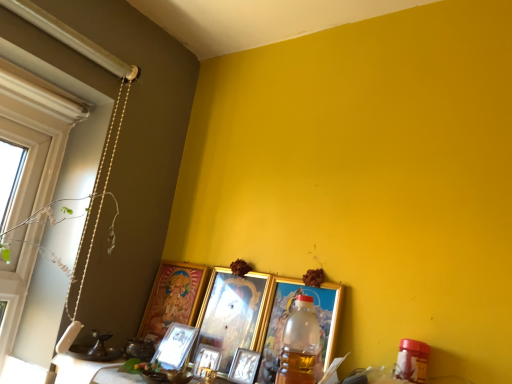
Where is `pearl necklace at left`? pearl necklace at left is located at coordinates (102, 191).

This screenshot has height=384, width=512. What do you see at coordinates (244, 366) in the screenshot?
I see `metallic gold picture frame at center, the fifth picture frame when ordered from left to right` at bounding box center [244, 366].

You are a GUI agent. You are given a task and a screenshot of the screen. Output one action in this format:
    pyautogui.click(x=<x>, y=<y>)
    Task: Click on the metallic gold table at lower center
    
    Given the screenshot: What is the action you would take?
    pyautogui.click(x=91, y=372)

The height and width of the screenshot is (384, 512). What do you see at coordinates (91, 372) in the screenshot? I see `metallic gold table at lower center` at bounding box center [91, 372].

Where is `pearl necklace at left`? This screenshot has height=384, width=512. pearl necklace at left is located at coordinates (102, 191).

Visually, is metallic silver picture frame at lower center, the 2th picture frame from the left, positioned to the left or to the right of gold metallic picture frame at center, which is the 6th picture frame from left to right?

In the image, metallic silver picture frame at lower center, the 2th picture frame from the left, appears on the left side of gold metallic picture frame at center, which is the 6th picture frame from left to right.

From the image's perspective, is metallic silver picture frame at lower center, which appears as the 5th picture frame when viewed from the right, below gold metallic picture frame at center, which is the 6th picture frame from left to right?

Indeed, from the image's perspective, metallic silver picture frame at lower center, which appears as the 5th picture frame when viewed from the right, is shown beneath gold metallic picture frame at center, which is the 6th picture frame from left to right.

Looking at this image, can you tell me how much metallic silver picture frame at lower center, which appears as the 5th picture frame when viewed from the right, and gold metallic picture frame at center, arranged as the first picture frame when viewed from the right, differ in facing direction?

There is a 5.89-degree angle between the facing directions of metallic silver picture frame at lower center, which appears as the 5th picture frame when viewed from the right, and gold metallic picture frame at center, arranged as the first picture frame when viewed from the right.

From a real-world perspective, between metallic silver picture frame at lower center, the 2th picture frame from the left, and gold metallic picture frame at center, arranged as the first picture frame when viewed from the right, who is vertically lower?

From a 3D spatial view, metallic silver picture frame at lower center, the 2th picture frame from the left, is below.

Is gold metallic picture frame at center, the third picture frame positioned from the right, directly adjacent to pearl necklace at left?

gold metallic picture frame at center, the third picture frame positioned from the right, and pearl necklace at left are not in contact.

Is gold metallic picture frame at center, the third picture frame positioned from the right, in front of or behind pearl necklace at left in the image?

In the image, gold metallic picture frame at center, the third picture frame positioned from the right, appears behind pearl necklace at left.

Who is smaller, gold metallic picture frame at center, which is counted as the 4th picture frame, starting from the left, or pearl necklace at left?

Smaller between the two is pearl necklace at left.

Measure the distance from gold metallic picture frame at center, the third picture frame positioned from the right, to pearl necklace at left.

gold metallic picture frame at center, the third picture frame positioned from the right, and pearl necklace at left are 14.66 inches apart.

Are gold-framed picture at lower left, the first picture frame from the left, and metallic silver picture frame at lower center, which appears as the 5th picture frame when viewed from the right, far apart?

No, there isn't a large distance between gold-framed picture at lower left, the first picture frame from the left, and metallic silver picture frame at lower center, which appears as the 5th picture frame when viewed from the right.

Can you confirm if gold-framed picture at lower left, the 6th picture frame positioned from the right, is wider than metallic silver picture frame at lower center, which appears as the 5th picture frame when viewed from the right?

Correct, the width of gold-framed picture at lower left, the 6th picture frame positioned from the right, exceeds that of metallic silver picture frame at lower center, which appears as the 5th picture frame when viewed from the right.

Is the position of gold-framed picture at lower left, the first picture frame from the left, less distant than that of metallic silver picture frame at lower center, the 2th picture frame from the left?

That is True.

From a real-world perspective, which is physically above, gold-framed picture at lower left, the first picture frame from the left, or metallic silver picture frame at lower center, which appears as the 5th picture frame when viewed from the right?

In real-world perspective, gold-framed picture at lower left, the first picture frame from the left, is above.

Based on their positions, is pearl necklace at left located to the left or right of metallic silver picture frame at center, positioned as the 4th picture frame in right-to-left order?

From the image, it's evident that pearl necklace at left is to the left of metallic silver picture frame at center, positioned as the 4th picture frame in right-to-left order.

From the image's perspective, does pearl necklace at left appear lower than metallic silver picture frame at center, positioned as the 4th picture frame in right-to-left order?

Incorrect, from the image's perspective, pearl necklace at left is higher than metallic silver picture frame at center, positioned as the 4th picture frame in right-to-left order.

Based on the photo, from a real-world perspective, is pearl necklace at left below metallic silver picture frame at center, positioned as the 4th picture frame in right-to-left order?

No, from a real-world perspective, pearl necklace at left is not beneath metallic silver picture frame at center, positioned as the 4th picture frame in right-to-left order.

Considering the sizes of pearl necklace at left and metallic silver picture frame at center, positioned as the 4th picture frame in right-to-left order, in the image, is pearl necklace at left wider or thinner than metallic silver picture frame at center, positioned as the 4th picture frame in right-to-left order,?

Considering their sizes, pearl necklace at left looks broader than metallic silver picture frame at center, positioned as the 4th picture frame in right-to-left order.

Based on their positions, is white matte window at left located to the left or right of translucent plastic bottle at center?

white matte window at left is positioned on translucent plastic bottle at center's left side.

This screenshot has height=384, width=512. I want to click on bottle below the white matte window at left (from the image's perspective), so click(300, 344).

From the image's perspective, which object appears higher, white matte window at left or translucent plastic bottle at center?

white matte window at left, from the image's perspective.

How many degrees apart are the facing directions of pearl necklace at left and gold metallic picture frame at center, arranged as the first picture frame when viewed from the right?

The facing directions of pearl necklace at left and gold metallic picture frame at center, arranged as the first picture frame when viewed from the right, are 88.2 degrees apart.

From the image's perspective, relative to gold metallic picture frame at center, which is the 6th picture frame from left to right, is pearl necklace at left above or below?

Clearly, from the image's perspective, pearl necklace at left is above gold metallic picture frame at center, which is the 6th picture frame from left to right.

Relative to gold metallic picture frame at center, which is the 6th picture frame from left to right, is pearl necklace at left in front or behind?

pearl necklace at left is positioned farther from the viewer than gold metallic picture frame at center, which is the 6th picture frame from left to right.

Considering the sizes of objects pearl necklace at left and gold metallic picture frame at center, arranged as the first picture frame when viewed from the right, in the image provided, who is thinner, pearl necklace at left or gold metallic picture frame at center, arranged as the first picture frame when viewed from the right,?

gold metallic picture frame at center, arranged as the first picture frame when viewed from the right.

Considering the positions of objects pearl necklace at left and metallic gold picture frame at center, the second picture frame from the right, in the image provided, who is more to the right, pearl necklace at left or metallic gold picture frame at center, the second picture frame from the right,?

metallic gold picture frame at center, the second picture frame from the right.

Is pearl necklace at left oriented towards metallic gold picture frame at center, the second picture frame from the right?

No, pearl necklace at left is not aimed at metallic gold picture frame at center, the second picture frame from the right.

Looking at this image, how different are the orientations of pearl necklace at left and metallic gold picture frame at center, the second picture frame from the right, in degrees?

The facing directions of pearl necklace at left and metallic gold picture frame at center, the second picture frame from the right, are 94.1 degrees apart.

Where is `picture frame that is the 5th object located in front of the metallic silver picture frame at lower center, the 2th picture frame from the left`? Image resolution: width=512 pixels, height=384 pixels. picture frame that is the 5th object located in front of the metallic silver picture frame at lower center, the 2th picture frame from the left is located at coordinates (287, 319).

Starting from the pearl necklace at left, which picture frame is the 1st one behind? Please provide its 2D coordinates.

[(231, 313)]

When comparing their distances from metallic gold table at lower center, does translucent plastic bottle at center or metallic silver picture frame at lower center, the 2th picture frame from the left, seem further?

Based on the image, translucent plastic bottle at center appears to be further to metallic gold table at lower center.

Estimate the real-world distances between objects in this image. Which object is closer to metallic silver picture frame at center, positioned as the 4th picture frame in right-to-left order, gold metallic picture frame at center, which is the 6th picture frame from left to right, or translucent plastic bottle at center?

Based on the image, gold metallic picture frame at center, which is the 6th picture frame from left to right, appears to be nearer to metallic silver picture frame at center, positioned as the 4th picture frame in right-to-left order.

When comparing their distances from metallic gold picture frame at center, the second picture frame from the right, does gold metallic picture frame at center, which is the 6th picture frame from left to right, or metallic silver picture frame at lower center, which appears as the 5th picture frame when viewed from the right, seem further?

metallic silver picture frame at lower center, which appears as the 5th picture frame when viewed from the right, is positioned further to the anchor metallic gold picture frame at center, the second picture frame from the right.

Estimate the real-world distances between objects in this image. Which object is closer to metallic silver picture frame at lower center, the 2th picture frame from the left, metallic gold picture frame at center, the fifth picture frame when ordered from left to right, or gold metallic picture frame at center, the third picture frame positioned from the right?

gold metallic picture frame at center, the third picture frame positioned from the right, is closer to metallic silver picture frame at lower center, the 2th picture frame from the left.

In the scene shown: Based on their spatial positions, is metallic gold table at lower center or translucent plastic bottle at center further from metallic gold picture frame at center, the fifth picture frame when ordered from left to right?

metallic gold table at lower center lies further to metallic gold picture frame at center, the fifth picture frame when ordered from left to right, than the other object.

From the image, which object appears to be farther from metallic silver picture frame at center, acting as the 3th picture frame starting from the left, metallic gold picture frame at center, the fifth picture frame when ordered from left to right, or metallic gold table at lower center?

metallic gold table at lower center is positioned further to the anchor metallic silver picture frame at center, acting as the 3th picture frame starting from the left.

When comparing their distances from white matte window at left, does gold-framed picture at lower left, the 6th picture frame positioned from the right, or gold metallic picture frame at center, the third picture frame positioned from the right, seem further?

A: Among the two, gold metallic picture frame at center, the third picture frame positioned from the right, is located further to white matte window at left.

From the image, which object appears to be nearer to gold-framed picture at lower left, the 6th picture frame positioned from the right, pearl necklace at left or metallic gold picture frame at center, the second picture frame from the right?

pearl necklace at left lies closer to gold-framed picture at lower left, the 6th picture frame positioned from the right, than the other object.

Identify the location of table between translucent plastic bottle at center and gold-framed picture at lower left, the first picture frame from the left, from front to back. (91, 372).

Identify the location of bottle located between metallic gold table at lower center and gold metallic picture frame at center, which is the 6th picture frame from left to right, in the left-right direction. This screenshot has height=384, width=512. (300, 344).

Locate an element on the screen. table between pearl necklace at left and gold metallic picture frame at center, arranged as the first picture frame when viewed from the right, from left to right is located at coordinates point(91,372).

At what (x,y) coordinates should I click in order to perform the action: click on bottle located between pearl necklace at left and gold metallic picture frame at center, which is the 6th picture frame from left to right, in the left-right direction. Please return your answer as a coordinate pair (x, y). Image resolution: width=512 pixels, height=384 pixels. Looking at the image, I should click on (300, 344).